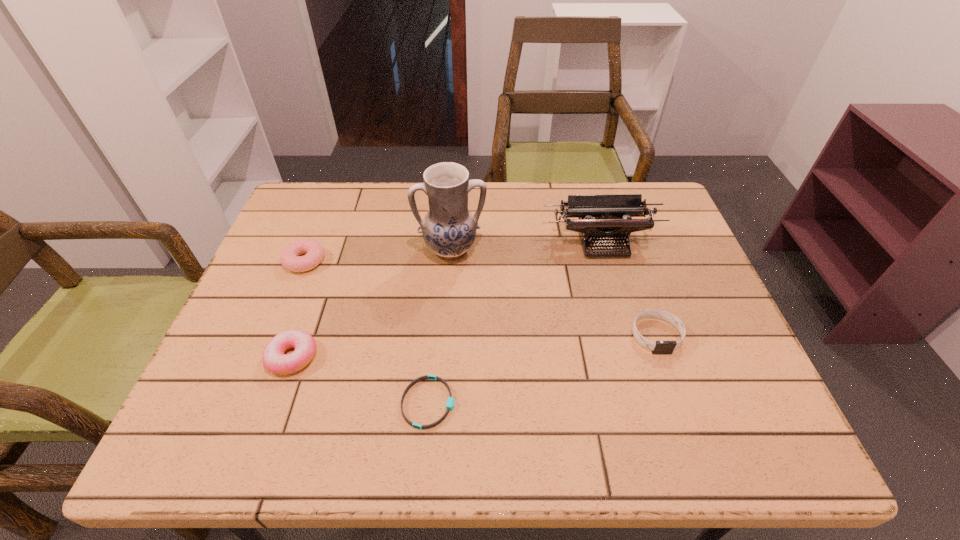
The width and height of the screenshot is (960, 540). What are the coordinates of `vacant space located on the right of the farther doughnut` in the screenshot? It's located at (424, 261).

Find the location of a particular element. This screenshot has height=540, width=960. vacant region located 0.150m on the outer surface of the taller wristband is located at coordinates (684, 420).

Identify the location of free space located 0.100m on the back of the nearer doughnut. (311, 303).

I want to click on vacant area located 0.120m on the buckle of the left wristband, so click(x=516, y=403).

Find the location of a particular element. Image resolution: width=960 pixels, height=540 pixels. object at the far edge is located at coordinates (x=613, y=214).

This screenshot has height=540, width=960. I want to click on object that is at the near edge, so click(x=450, y=404).

Identify the location of typewriter at the right edge. (613, 214).

At what (x,y) coordinates should I click in order to perform the action: click on wristband at the right edge. Please return your answer as a coordinate pair (x, y). Image resolution: width=960 pixels, height=540 pixels. Looking at the image, I should click on (659, 347).

Locate an element on the screen. This screenshot has height=540, width=960. object at the far right corner is located at coordinates (613, 214).

Locate an element on the screen. The width and height of the screenshot is (960, 540). vacant space at the far edge is located at coordinates (399, 215).